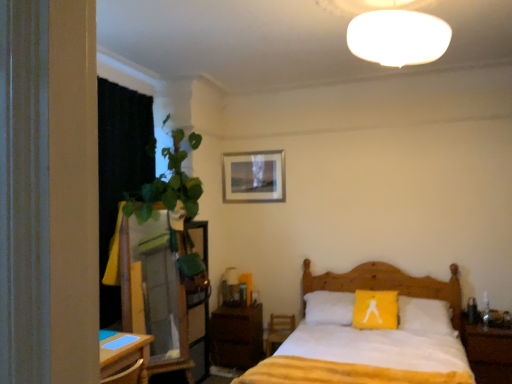
Question: From a real-world perspective, is matte glass table lamp at center located beneath wooden dresser at left?

Choices:
 (A) no
 (B) yes

Answer: (B)

Question: Does matte glass table lamp at center appear on the left side of wooden dresser at left?

Choices:
 (A) yes
 (B) no

Answer: (B)

Question: Does matte glass table lamp at center have a greater height compared to wooden dresser at left?

Choices:
 (A) no
 (B) yes

Answer: (A)

Question: Is matte glass table lamp at center not near wooden dresser at left?

Choices:
 (A) no
 (B) yes

Answer: (B)

Question: Is wooden dresser at left inside matte glass table lamp at center?

Choices:
 (A) yes
 (B) no

Answer: (B)

Question: From the image's perspective, is dark brown wood nightstand at lower center, which is counted as the 1th nightstand, starting from the left, above or below matte glass table lamp at center?

Choices:
 (A) below
 (B) above

Answer: (A)

Question: From a real-world perspective, relative to matte glass table lamp at center, is dark brown wood nightstand at lower center, the 2th nightstand viewed from the front, vertically above or below?

Choices:
 (A) above
 (B) below

Answer: (B)

Question: Is dark brown wood nightstand at lower center, the 2th nightstand from the right, bigger or smaller than matte glass table lamp at center?

Choices:
 (A) small
 (B) big

Answer: (B)

Question: Considering the positions of dark brown wood nightstand at lower center, the 2th nightstand from the right, and matte glass table lamp at center in the image, is dark brown wood nightstand at lower center, the 2th nightstand from the right, wider or thinner than matte glass table lamp at center?

Choices:
 (A) thin
 (B) wide

Answer: (B)

Question: From the image's perspective, is wooden nightstand at right, arranged as the 1th nightstand when viewed from the front, above or below black fabric curtain at left?

Choices:
 (A) above
 (B) below

Answer: (B)

Question: From a real-world perspective, is wooden nightstand at right, arranged as the 1th nightstand when viewed from the front, physically located above or below black fabric curtain at left?

Choices:
 (A) above
 (B) below

Answer: (B)

Question: From their relative heights in the image, would you say wooden nightstand at right, arranged as the 1th nightstand when viewed from the front, is taller or shorter than black fabric curtain at left?

Choices:
 (A) tall
 (B) short

Answer: (B)

Question: Relative to black fabric curtain at left, is wooden nightstand at right, which appears as the 2th nightstand when viewed from the left, in front or behind?

Choices:
 (A) behind
 (B) front

Answer: (A)

Question: Considering the positions of matte glass table lamp at center and black fabric curtain at left in the image, is matte glass table lamp at center wider or thinner than black fabric curtain at left?

Choices:
 (A) thin
 (B) wide

Answer: (A)

Question: Is matte glass table lamp at center bigger or smaller than black fabric curtain at left?

Choices:
 (A) small
 (B) big

Answer: (A)